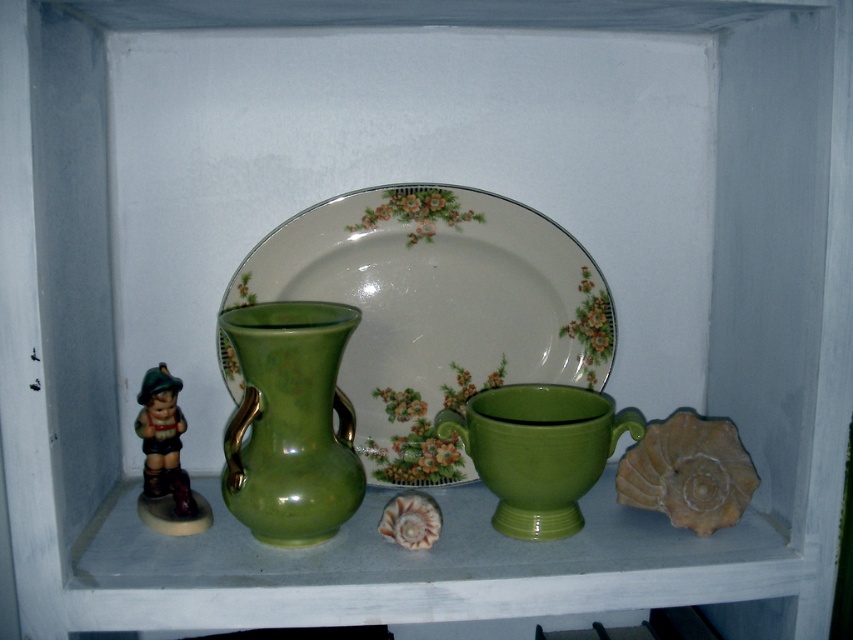
You are arranging a display on a shelf and want to place the porcelain floral platter at center and the green glossy vase at center. Which object should you place first to ensure proper stacking?

The porcelain floral platter at center should be placed first because it is positioned over the green glossy vase at center, meaning the vase needs to be at the bottom to support it.

You are an interior designer arranging items on a shelf. You have a porcelain floral platter at center and a green glossy vase at center. Which object should you place in a position that requires more space to avoid overcrowding?

The porcelain floral platter at center is larger in size than the green glossy vase at center, so you should place the porcelain floral platter at center in a position that requires more space to avoid overcrowding.